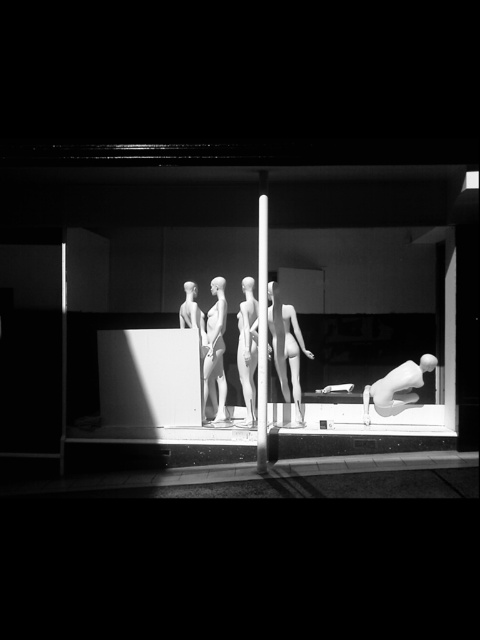
This screenshot has height=640, width=480. What do you see at coordinates (262, 326) in the screenshot?
I see `white glossy pole at center` at bounding box center [262, 326].

Who is taller, white glossy pole at center or matte white mannequin at center?

white glossy pole at center is taller.

Image resolution: width=480 pixels, height=640 pixels. What do you see at coordinates (262, 326) in the screenshot? I see `white glossy pole at center` at bounding box center [262, 326].

The width and height of the screenshot is (480, 640). I want to click on white glossy pole at center, so click(262, 326).